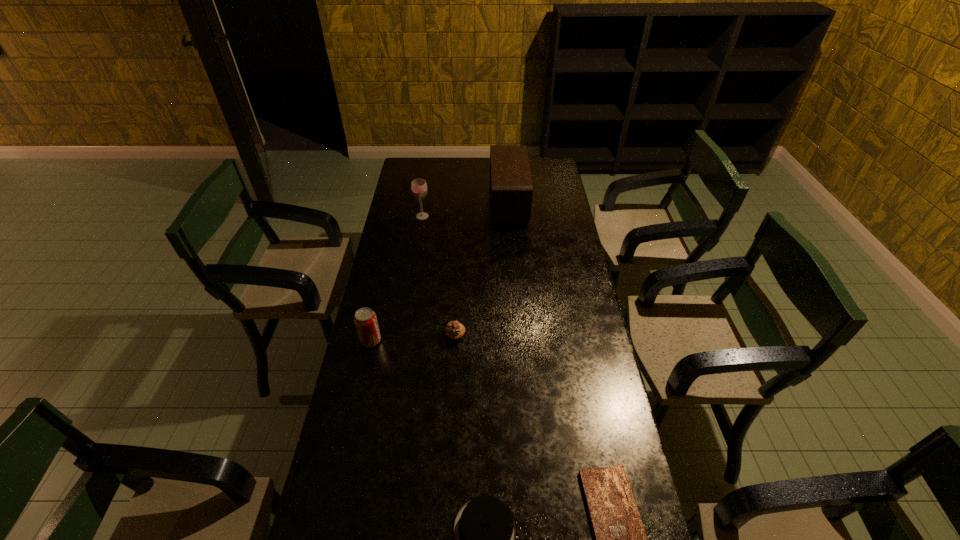
At what (x,y) coordinates should I click in order to perform the action: click on free space located 0.160m on the logo side of the soda can. Please return your answer as a coordinate pair (x, y). The width and height of the screenshot is (960, 540). Looking at the image, I should click on (426, 341).

Locate an element on the screen. The height and width of the screenshot is (540, 960). free space located 0.190m on the left of the fourth tallest object is located at coordinates (393, 336).

Image resolution: width=960 pixels, height=540 pixels. Identify the location of wineglass located in the left edge section of the desktop. (418, 186).

Where is `soda can located in the left edge section of the desktop`? This screenshot has height=540, width=960. soda can located in the left edge section of the desktop is located at coordinates (365, 319).

In the image, there is a desktop. Where is `vacant space at the far edge`? The height and width of the screenshot is (540, 960). vacant space at the far edge is located at coordinates (439, 160).

In the image, there is a desktop. At what (x,y) coordinates should I click in order to perform the action: click on free space at the left edge. Please return your answer as a coordinate pair (x, y). Looking at the image, I should click on click(x=417, y=262).

Identify the location of vacant space at the right edge. (550, 229).

Identify the location of free spot at the far right corner of the desktop. (558, 181).

The width and height of the screenshot is (960, 540). Identify the location of empty space that is in between the fourth tallest object and the wineglass. click(x=439, y=276).

You are a GUI agent. You are given a task and a screenshot of the screen. Output one action in this format:
    pyautogui.click(x=<x>, y=<y>)
    Task: Click on the free space between the wineglass and the soda can
    The image size is (960, 540).
    Given the screenshot: What is the action you would take?
    pyautogui.click(x=396, y=278)